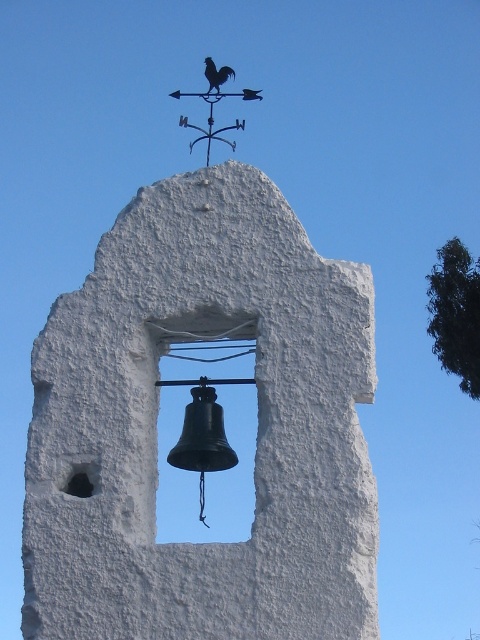
Does black metal weather vane at upper center have a lesser height compared to shiny black rooster at upper center?

Incorrect, black metal weather vane at upper center's height does not fall short of shiny black rooster at upper center's.

Who is more forward, (197, 138) or (217, 74)?

Point (197, 138)

Does point (176, 97) lie in front of point (214, 65)?

That is False.

The height and width of the screenshot is (640, 480). I want to click on black metal weather vane at upper center, so click(x=213, y=116).